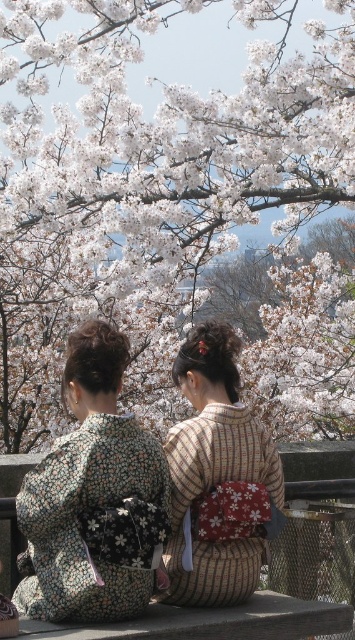
Between floral kimono at center and striped fabric kimono at center, which one appears on the left side from the viewer's perspective?

From the viewer's perspective, floral kimono at center appears more on the left side.

Does point (40, 586) come farther from viewer compared to point (225, 524)?

No, it is not.

Where is `floral kimono at center`? Image resolution: width=355 pixels, height=640 pixels. floral kimono at center is located at coordinates (89, 493).

Can you confirm if white blossoms at upper center is positioned below striped fabric kimono at center?

Actually, white blossoms at upper center is above striped fabric kimono at center.

This screenshot has width=355, height=640. Find the location of `white blossoms at upper center`. white blossoms at upper center is located at coordinates (150, 180).

Does point (29, 310) come closer to viewer compared to point (215, 340)?

No.

What are the coordinates of `white blossoms at upper center` in the screenshot? It's located at point(150,180).

Is white blossoms at upper center to the left of floral kimono at center from the viewer's perspective?

No, white blossoms at upper center is not to the left of floral kimono at center.

Does point (23, 170) come closer to viewer compared to point (167, 493)?

No, (23, 170) is behind (167, 493).

Locate an element on the screen. The image size is (355, 640). white blossoms at upper center is located at coordinates (150, 180).